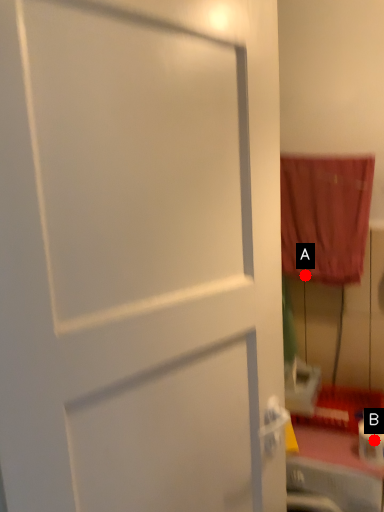
Question: Two points are circled on the image, labeled by A and B beside each circle. Which of the following is the closest to the observer?

Choices:
 (A) A is closer
 (B) B is closer

Answer: (B)